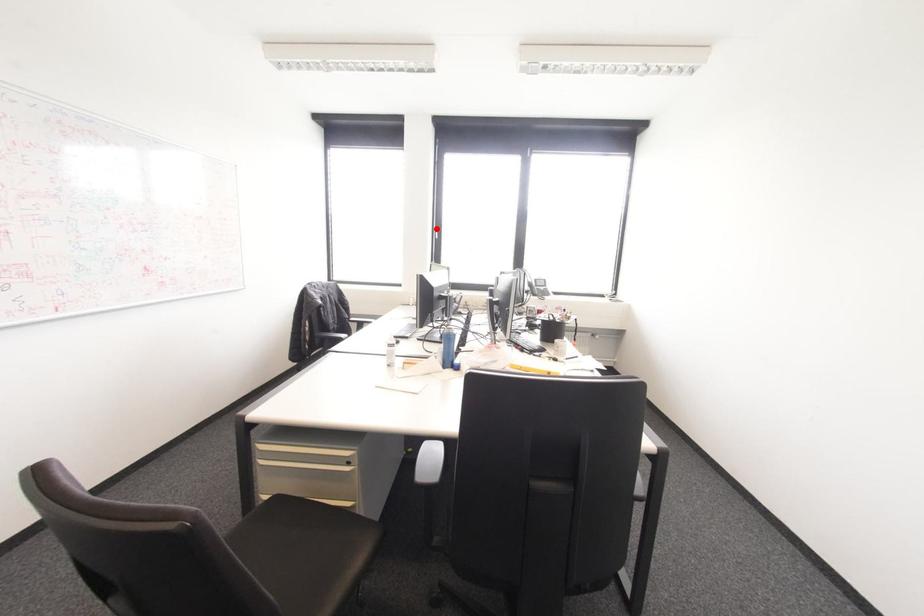
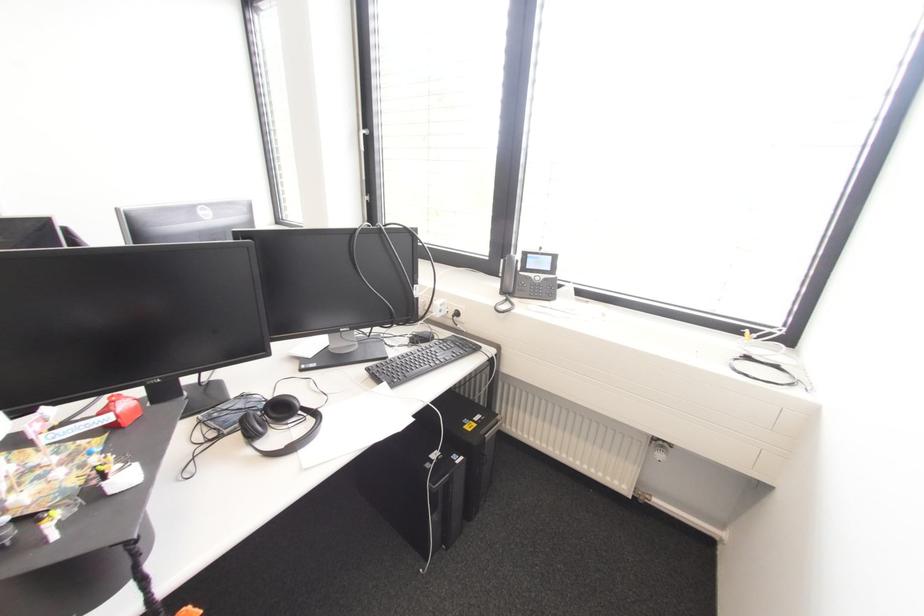
Question: A red point is marked in image1. In image2, is the corresponding 3D point closer to the camera or farther? Reply with the corresponding letter.

Choices:
 (A) The corresponding 3D point is closer.
 (B) The corresponding 3D point is farther.

Answer: (B)